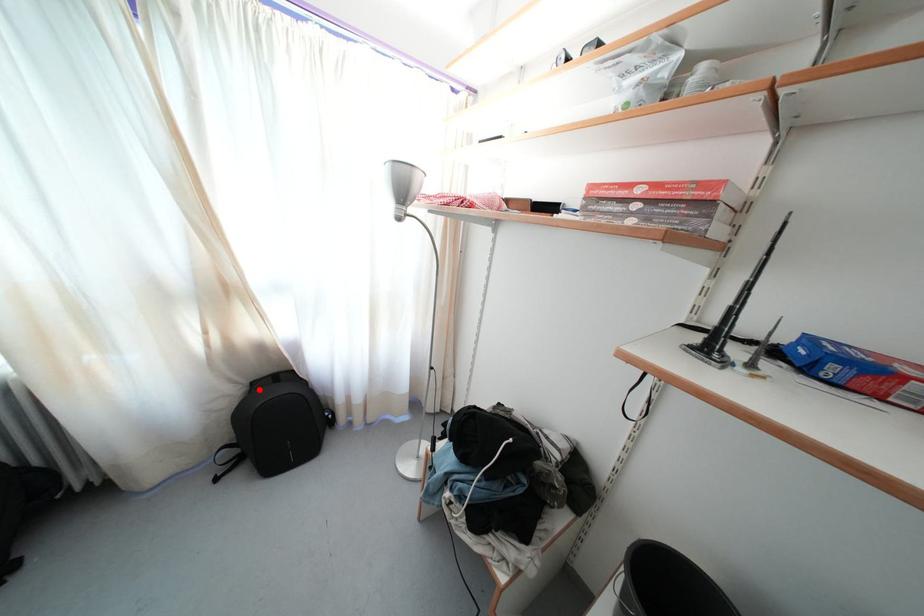
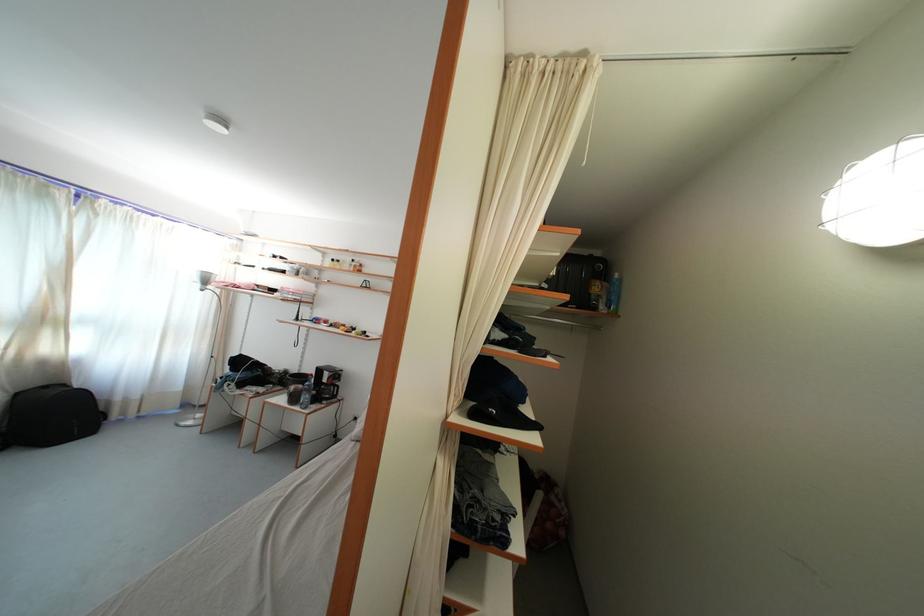
Find the pixel in the second image that matches the highlighted location in the first image.

(23, 400)